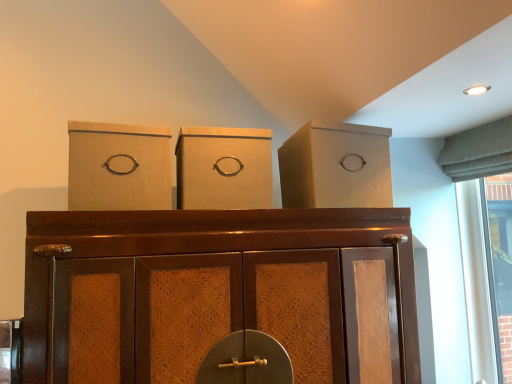
Question: Is matte cardboard box at upper right to the left or to the right of matte cardboard box at center, the second cardboard box in the left-to-right sequence, in the image?

Choices:
 (A) right
 (B) left

Answer: (A)

Question: From a real-world perspective, is matte cardboard box at upper right physically located above or below matte cardboard box at center, which appears as the first cardboard box when viewed from the right?

Choices:
 (A) below
 (B) above

Answer: (B)

Question: Considering the real-world distances, which object is farthest from the matte cardboard box at upper right?

Choices:
 (A) brown wood cupboard at center
 (B) matte cardboard box at left, the first cardboard box from the left
 (C) matte cardboard box at center, the second cardboard box in the left-to-right sequence

Answer: (B)

Question: Considering the real-world distances, which object is farthest from the matte cardboard box at upper right?

Choices:
 (A) matte cardboard box at left, the first cardboard box from the left
 (B) brown wood cupboard at center
 (C) matte cardboard box at center, which appears as the first cardboard box when viewed from the right

Answer: (A)